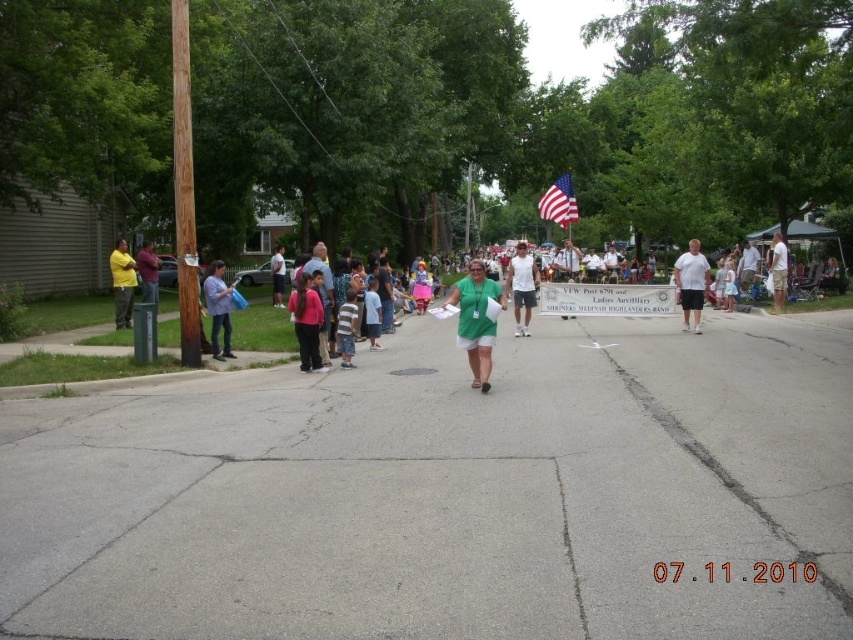
You are a photographer standing at the side of the street during the parade. You want to capture a photo that includes both the white paper banner at center and the white cotton tank top at center. Which object will appear smaller in the photo?

The white paper banner at center has a lesser height compared to the white cotton tank top at center, so it will appear smaller in the photo.

You are a photographer trying to capture the scene of the community event. You notice a point at coordinates (x=691, y=284). What object is located at that point?

The point at coordinates (x=691, y=284) indicates a white cotton t shirt at center.